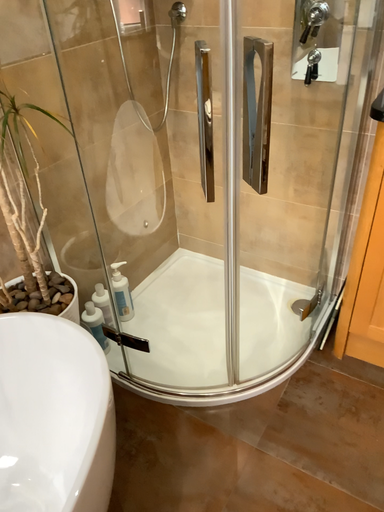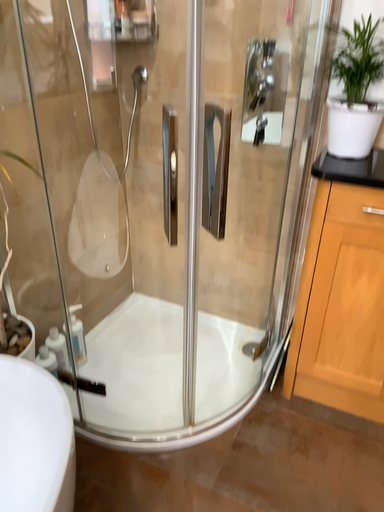
Question: How did the camera likely rotate when shooting the video?

Choices:
 (A) rotated right
 (B) rotated left

Answer: (A)